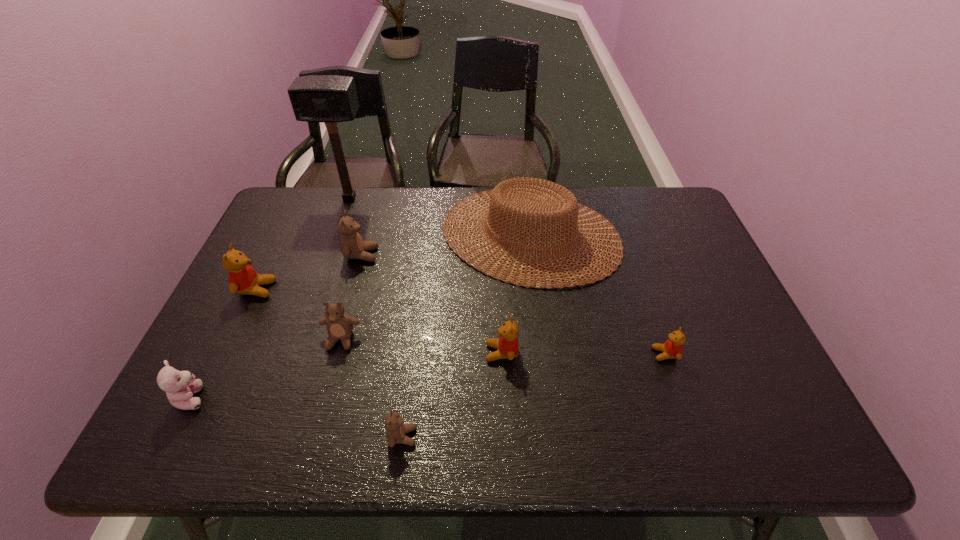
Find the location of a particular element. The height and width of the screenshot is (540, 960). object that is the second closest to the second smallest red teddy bear is located at coordinates (396, 430).

Where is `teddy bear that stands as the sixth closest to the nearest teddy bear`? teddy bear that stands as the sixth closest to the nearest teddy bear is located at coordinates (672, 348).

Locate an element on the screen. The image size is (960, 540). teddy bear that is the second nearest to the second biggest red teddy bear is located at coordinates (339, 325).

This screenshot has width=960, height=540. I want to click on brown teddy bear that stands as the closest to the beige sunhat, so click(x=352, y=245).

Identify which brown teddy bear is the second closest to the smallest brown teddy bear. Please provide its 2D coordinates. Your answer should be formatted as a tuple, i.e. [(x, y)], where the tuple contains the x and y coordinates of a point satisfying the conditions above.

[(352, 245)]

Locate which red teddy bear ranks in proximity to the rightmost red teddy bear. Please provide its 2D coordinates. Your answer should be formatted as a tuple, i.e. [(x, y)], where the tuple contains the x and y coordinates of a point satisfying the conditions above.

[(507, 345)]

Locate which red teddy bear is the third closest to the mallet. Please provide its 2D coordinates. Your answer should be formatted as a tuple, i.e. [(x, y)], where the tuple contains the x and y coordinates of a point satisfying the conditions above.

[(672, 348)]

Locate an element on the screen. vacant area in the image that satisfies the following two spatial constraints: 1. on the front-facing side of the second biggest brown teddy bear; 2. at the face of the eighth farthest object is located at coordinates (325, 397).

This screenshot has width=960, height=540. What are the coordinates of `free space that satisfies the following two spatial constraints: 1. on the front-facing side of the second smallest brown teddy bear; 2. at the face of the pink teddy bear` in the screenshot? It's located at (325, 397).